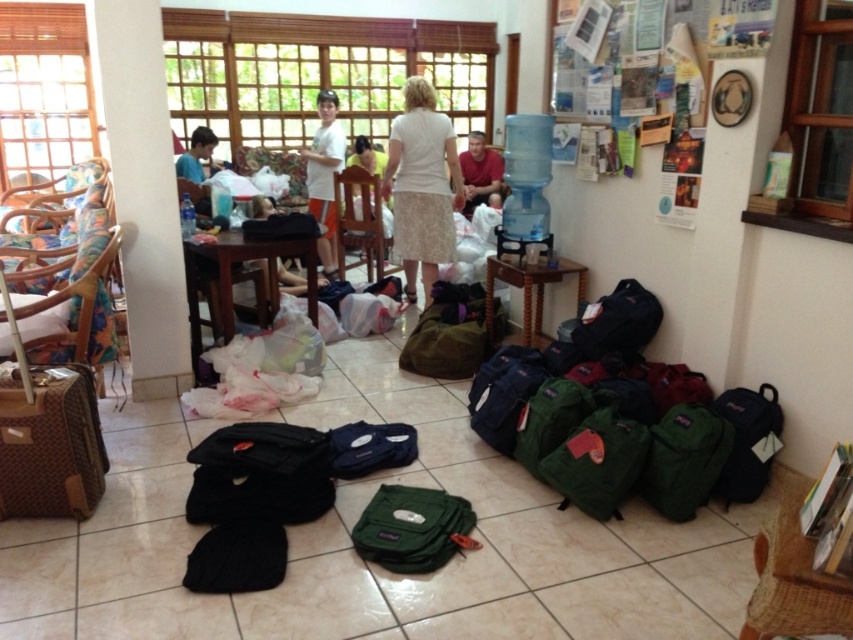
Between point (309, 179) and point (200, 172), which one is positioned behind?

Point (309, 179)

Between white matte t-shirt at center and matte blue shirt at lower left, which one is positioned higher?

matte blue shirt at lower left is higher up.

Does point (323, 90) come closer to viewer compared to point (190, 163)?

No, (323, 90) is further to viewer.

Where is `white matte t-shirt at center`? The height and width of the screenshot is (640, 853). white matte t-shirt at center is located at coordinates (323, 176).

Does white matte t-shirt at center appear over matte red shirt at center?

Actually, white matte t-shirt at center is below matte red shirt at center.

Is white matte t-shirt at center smaller than matte red shirt at center?

Incorrect, white matte t-shirt at center is not smaller in size than matte red shirt at center.

What do you see at coordinates (323, 176) in the screenshot?
I see `white matte t-shirt at center` at bounding box center [323, 176].

I want to click on white matte t-shirt at center, so click(323, 176).

What do you see at coordinates (422, 186) in the screenshot? Image resolution: width=853 pixels, height=640 pixels. I see `white textured skirt at center` at bounding box center [422, 186].

Is white textured skirt at center below matte red shirt at center?

Yes, white textured skirt at center is below matte red shirt at center.

Locate an element on the screen. Image resolution: width=853 pixels, height=640 pixels. white textured skirt at center is located at coordinates (422, 186).

Locate an element on the screen. This screenshot has height=640, width=853. white textured skirt at center is located at coordinates (422, 186).